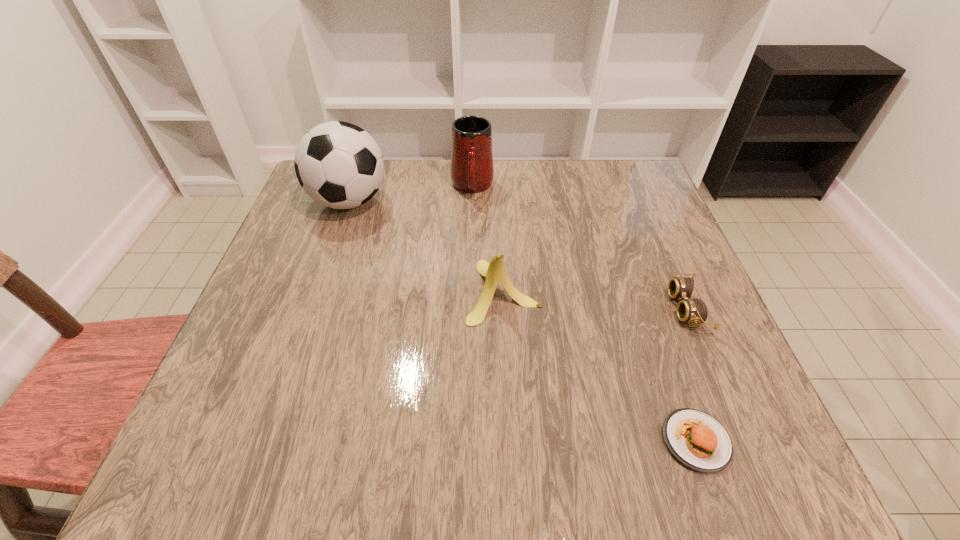
The height and width of the screenshot is (540, 960). What are the coordinates of `vacant space that satisfies the following two spatial constraints: 1. on the side of the mug with the handle; 2. on the left side of the food` in the screenshot? It's located at (467, 441).